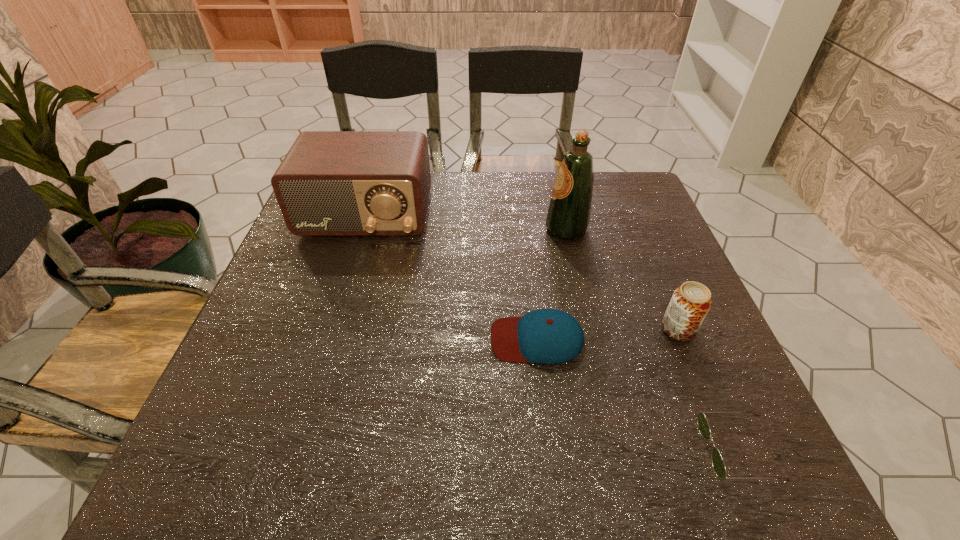
Find the location of a particular element. The width and height of the screenshot is (960, 540). free space at the far right corner of the desktop is located at coordinates (619, 197).

The image size is (960, 540). What are the coordinates of `free space that is in between the radio receiver and the second shortest object` in the screenshot? It's located at (451, 278).

Find the location of a particular element. free space between the tallest object and the sunglasses is located at coordinates (653, 340).

Find the location of a particular element. free point between the third tallest object and the baseball cap is located at coordinates (608, 334).

This screenshot has width=960, height=540. What are the coordinates of `empty space that is in between the sunglasses and the beer can` in the screenshot? It's located at (708, 390).

This screenshot has height=540, width=960. Find the location of `unoccupied position between the shortest object and the third tallest object`. unoccupied position between the shortest object and the third tallest object is located at coordinates (708, 390).

At what (x,y) coordinates should I click in order to perform the action: click on unoccupied position between the beer can and the baseball cap. Please return your answer as a coordinate pair (x, y). The image size is (960, 540). Looking at the image, I should click on (608, 334).

Where is `empty space between the sunglasses and the tallest object`? empty space between the sunglasses and the tallest object is located at coordinates (653, 340).

Find the location of a particular element. vacant area between the radio receiver and the olive oil is located at coordinates (466, 222).

This screenshot has width=960, height=540. Identify the location of object that ranks as the second closest to the third shortest object. (548, 336).